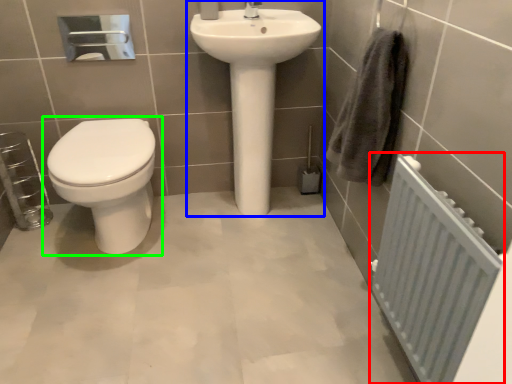
Question: Estimate the real-world distances between objects in this image. Which object is closer to radiator (highlighted by a red box), sink (highlighted by a blue box) or toilet (highlighted by a green box)?

Choices:
 (A) sink
 (B) toilet

Answer: (A)